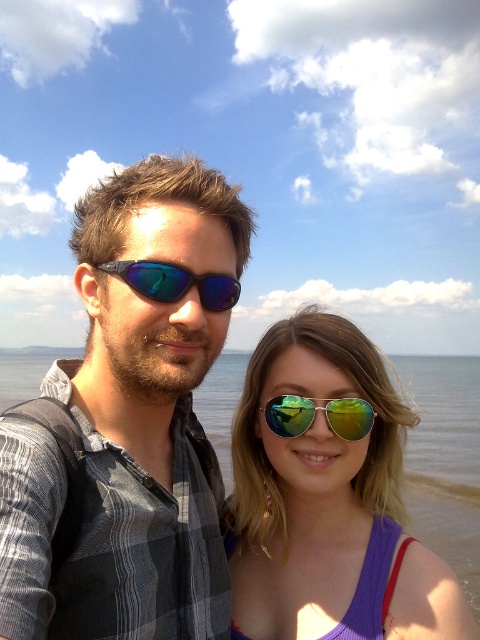
Question: Can you confirm if matte black sunglasses at center is positioned above shiny reflective sunglasses at center?

Choices:
 (A) no
 (B) yes

Answer: (B)

Question: Among these objects, which one is nearest to the camera?

Choices:
 (A) matte black sunglasses at center
 (B) reflective gold sunglasses at center
 (C) clear water at center
 (D) shiny reflective sunglasses at center

Answer: (A)

Question: Can you confirm if shiny reflective sunglasses at center is thinner than reflective gold sunglasses at center?

Choices:
 (A) yes
 (B) no

Answer: (B)

Question: Is the position of clear water at center less distant than that of reflective gold sunglasses at center?

Choices:
 (A) yes
 (B) no

Answer: (B)

Question: Which of the following is the farthest from the observer?

Choices:
 (A) clear water at center
 (B) reflective gold sunglasses at center
 (C) matte black sunglasses at center
 (D) reflective plastic sunglasses at center

Answer: (A)

Question: Which object is closer to the camera taking this photo?

Choices:
 (A) clear water at center
 (B) reflective gold sunglasses at center

Answer: (B)